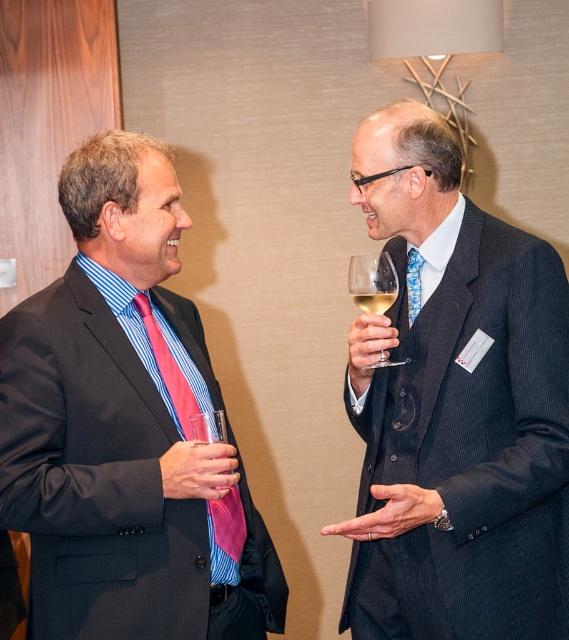
Between blue printed tie at right and clear glass wine at right, which one appears on the right side from the viewer's perspective?

blue printed tie at right is more to the right.

Is blue printed tie at right shorter than clear glass wine at right?

No.

Does point (414, 301) come farther from viewer compared to point (382, 305)?

Yes, it is behind point (382, 305).

Where is `blue printed tie at right`? blue printed tie at right is located at coordinates (414, 282).

Is the position of pink silk tie at left less distant than that of clear glass wine at right?

Yes, pink silk tie at left is closer to the viewer.

Does pink silk tie at left come behind clear glass wine at right?

No.

Find the location of a particular element. The height and width of the screenshot is (640, 569). pink silk tie at left is located at coordinates (125, 428).

Identify the location of pink silk tie at left. The height and width of the screenshot is (640, 569). (125, 428).

Is pink satin tie at left closer to the viewer compared to blue printed tie at right?

Yes.

Is pink satin tie at left above blue printed tie at right?

No.

Is point (228, 531) positioned after point (410, 275)?

No, it is not.

Where is `pink satin tie at left`? The width and height of the screenshot is (569, 640). pink satin tie at left is located at coordinates (168, 369).